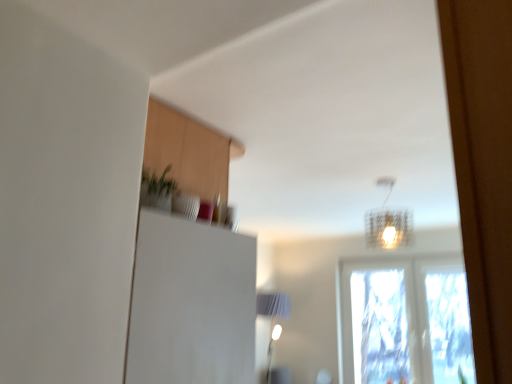
Question: Choose the correct answer: Is translucent wire mesh lampshade at upper center inside transparent glass window at center or outside it?

Choices:
 (A) inside
 (B) outside

Answer: (B)

Question: Visually, is translucent wire mesh lampshade at upper center positioned to the left or to the right of transparent glass window at center?

Choices:
 (A) right
 (B) left

Answer: (B)

Question: From a real-world perspective, is translucent wire mesh lampshade at upper center positioned above or below transparent glass window at center?

Choices:
 (A) below
 (B) above

Answer: (B)

Question: In the image, is transparent glass window at center positioned in front of or behind translucent wire mesh lampshade at upper center?

Choices:
 (A) behind
 (B) front

Answer: (A)

Question: Looking at the image, does transparent glass window at center seem bigger or smaller compared to translucent wire mesh lampshade at upper center?

Choices:
 (A) big
 (B) small

Answer: (A)

Question: From their relative heights in the image, would you say transparent glass window at center is taller or shorter than translucent wire mesh lampshade at upper center?

Choices:
 (A) short
 (B) tall

Answer: (B)

Question: Is transparent glass window at center wider or thinner than translucent wire mesh lampshade at upper center?

Choices:
 (A) thin
 (B) wide

Answer: (A)